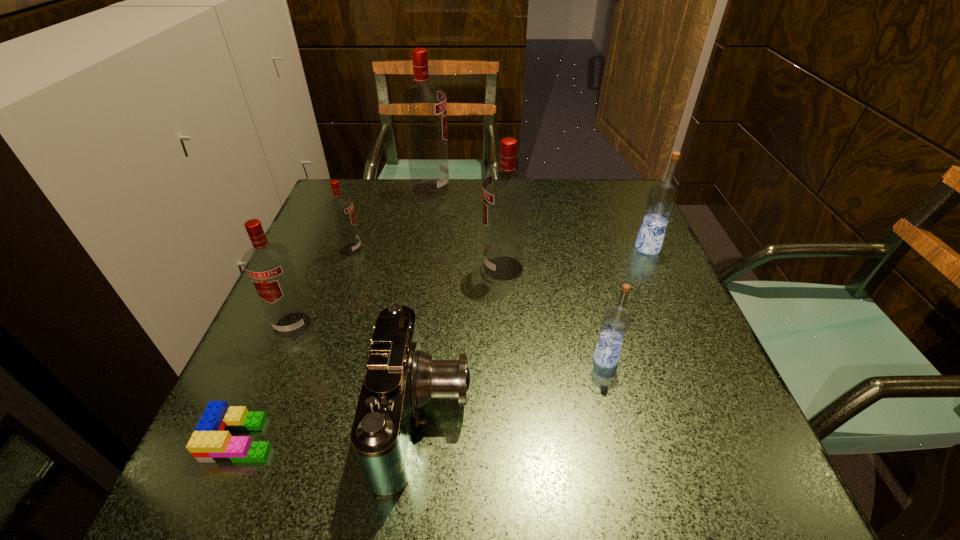
I want to click on the third red vodka from left to right, so click(x=423, y=106).

Find the location of a particular element. This screenshot has height=540, width=960. the farthest vodka is located at coordinates (423, 106).

I want to click on the rightmost red vodka, so click(506, 193).

Image resolution: width=960 pixels, height=540 pixels. Find the location of `the second biggest red vodka`. the second biggest red vodka is located at coordinates [506, 193].

Find the location of a particular element. the rightmost vodka is located at coordinates (662, 199).

The image size is (960, 540). I want to click on the right blue vodka, so click(x=662, y=199).

This screenshot has width=960, height=540. What are the coordinates of `the nearest red vodka` in the screenshot? It's located at (268, 265).

The height and width of the screenshot is (540, 960). Identify the location of the fifth farthest object. (268, 265).

Locate an element on the screen. the smallest red vodka is located at coordinates (340, 208).

At what (x,y) coordinates should I click in order to perform the action: click on the nearer blue vodka. Please return your answer as a coordinate pair (x, y). Looking at the image, I should click on (616, 320).